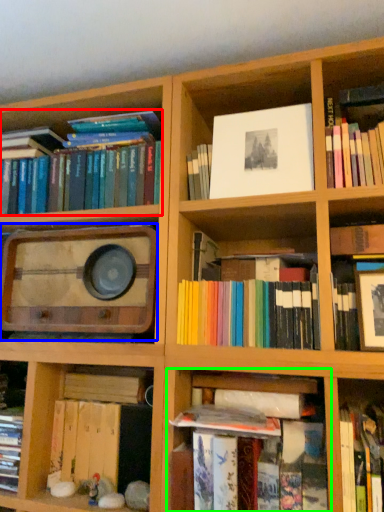
Question: Which is farther away from book (highlighted by a red box)? stereo (highlighted by a blue box) or shelf (highlighted by a green box)?

Choices:
 (A) stereo
 (B) shelf

Answer: (B)